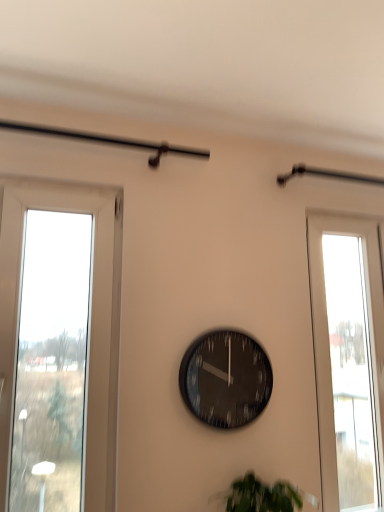
Question: Is black glass clock at center next to green leafy plant at lower center?

Choices:
 (A) yes
 (B) no

Answer: (B)

Question: Does black glass clock at center appear on the right side of green leafy plant at lower center?

Choices:
 (A) no
 (B) yes

Answer: (A)

Question: Is black glass clock at center surrounding green leafy plant at lower center?

Choices:
 (A) no
 (B) yes

Answer: (A)

Question: From a real-world perspective, is black glass clock at center positioned under green leafy plant at lower center based on gravity?

Choices:
 (A) no
 (B) yes

Answer: (A)

Question: Does black glass clock at center come in front of green leafy plant at lower center?

Choices:
 (A) yes
 (B) no

Answer: (B)

Question: Is point (370, 342) positioned closer to the camera than point (226, 494)?

Choices:
 (A) closer
 (B) farther

Answer: (B)

Question: From a real-world perspective, is transparent glass window at right above or below green leafy plant at lower center?

Choices:
 (A) above
 (B) below

Answer: (A)

Question: Is transparent glass window at right to the left or to the right of green leafy plant at lower center in the image?

Choices:
 (A) right
 (B) left

Answer: (A)

Question: Considering their positions, is transparent glass window at right located in front of or behind green leafy plant at lower center?

Choices:
 (A) front
 (B) behind

Answer: (B)

Question: From the image's perspective, is transparent glass window at right located above or below black glass clock at center?

Choices:
 (A) above
 (B) below

Answer: (A)

Question: In terms of height, does transparent glass window at right look taller or shorter compared to black glass clock at center?

Choices:
 (A) tall
 (B) short

Answer: (A)

Question: In terms of width, does transparent glass window at right look wider or thinner when compared to black glass clock at center?

Choices:
 (A) thin
 (B) wide

Answer: (B)

Question: Is point tap(347, 298) closer or farther from the camera than point tap(196, 398)?

Choices:
 (A) closer
 (B) farther

Answer: (B)

Question: In terms of size, does green leafy plant at lower center appear bigger or smaller than black glass clock at center?

Choices:
 (A) small
 (B) big

Answer: (B)

Question: From the image's perspective, is green leafy plant at lower center located above or below black glass clock at center?

Choices:
 (A) above
 (B) below

Answer: (B)